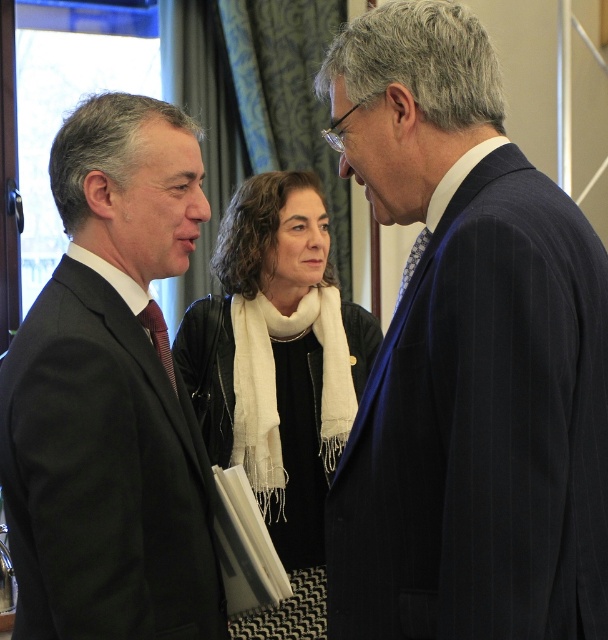
Question: Which object is positioned closest to the white scarf at center?

Choices:
 (A) black suit at left
 (B) dark blue pinstripe suit at right

Answer: (A)

Question: Is black suit at left closer to camera compared to white scarf at center?

Choices:
 (A) no
 (B) yes

Answer: (B)

Question: Is dark blue pinstripe suit at right further to the viewer compared to black suit at left?

Choices:
 (A) no
 (B) yes

Answer: (A)

Question: Which point is farther to the camera?

Choices:
 (A) (134, 561)
 (B) (196, 412)

Answer: (B)

Question: Which object is the farthest from the dark blue pinstripe suit at right?

Choices:
 (A) white scarf at center
 (B) black suit at left

Answer: (A)

Question: Can you confirm if dark blue pinstripe suit at right is thinner than white scarf at center?

Choices:
 (A) yes
 (B) no

Answer: (A)